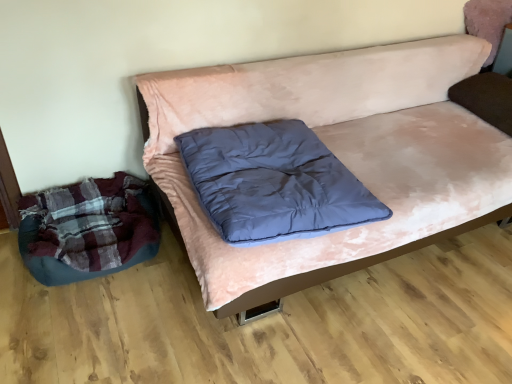
Question: Can you confirm if plush dark blue bean bag at lower left is taller than dark blue down at center?

Choices:
 (A) yes
 (B) no

Answer: (A)

Question: Is plush dark blue bean bag at lower left located outside dark blue down at center?

Choices:
 (A) yes
 (B) no

Answer: (A)

Question: Could you tell me if plush dark blue bean bag at lower left is turned towards dark blue down at center?

Choices:
 (A) no
 (B) yes

Answer: (A)

Question: Can you see plush dark blue bean bag at lower left touching dark blue down at center?

Choices:
 (A) no
 (B) yes

Answer: (A)

Question: Considering the relative positions of plush dark blue bean bag at lower left and dark blue down at center in the image provided, is plush dark blue bean bag at lower left to the left of dark blue down at center from the viewer's perspective?

Choices:
 (A) yes
 (B) no

Answer: (A)

Question: Is the position of plush dark blue bean bag at lower left less distant than that of dark blue down at center?

Choices:
 (A) yes
 (B) no

Answer: (B)

Question: Considering the relative positions of pink velvety couch at center and dark blue down at center in the image provided, is pink velvety couch at center to the left of dark blue down at center from the viewer's perspective?

Choices:
 (A) no
 (B) yes

Answer: (A)

Question: Is pink velvety couch at center far from dark blue down at center?

Choices:
 (A) yes
 (B) no

Answer: (B)

Question: From the image's perspective, is pink velvety couch at center below dark blue down at center?

Choices:
 (A) yes
 (B) no

Answer: (B)

Question: Is pink velvety couch at center wider than dark blue down at center?

Choices:
 (A) yes
 (B) no

Answer: (A)

Question: Is pink velvety couch at center further to camera compared to dark blue down at center?

Choices:
 (A) no
 (B) yes

Answer: (A)

Question: Is pink velvety couch at center with dark blue down at center?

Choices:
 (A) no
 (B) yes

Answer: (A)

Question: Is dark blue down at center to the left of plush dark blue bean bag at lower left from the viewer's perspective?

Choices:
 (A) yes
 (B) no

Answer: (B)